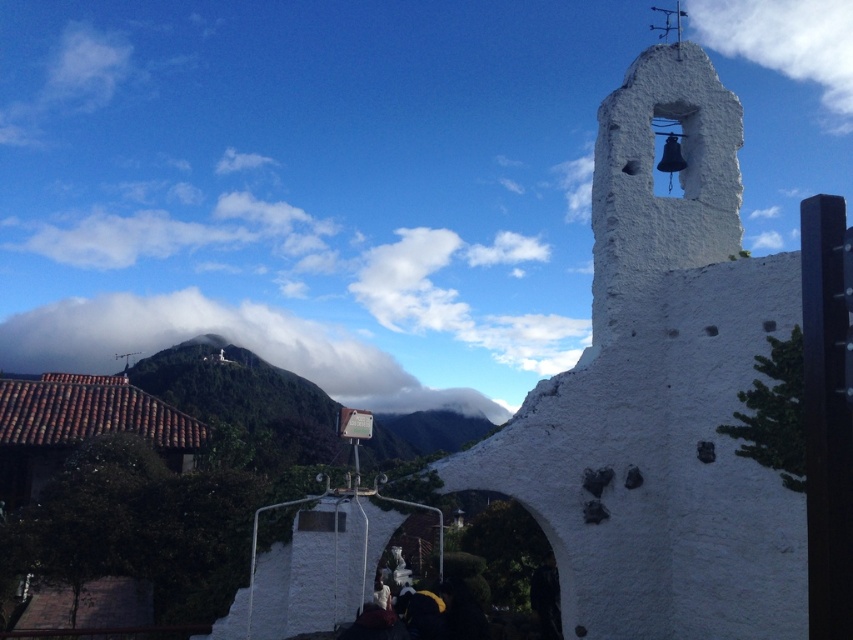
Does green grassy hill at lower left appear on the left side of white fluffy cloud at upper center?

Yes, green grassy hill at lower left is to the left of white fluffy cloud at upper center.

Who is more forward, (210, 384) or (816, 83)?

Point (210, 384) is in front.

Image resolution: width=853 pixels, height=640 pixels. I want to click on green grassy hill at lower left, so click(242, 394).

Does white fluffy cloud at upper left have a lesser width compared to white fluffy cloud at upper center?

Incorrect, white fluffy cloud at upper left's width is not less than white fluffy cloud at upper center's.

Between point (421, 397) and point (842, 19), which one is positioned behind?

The point (842, 19) is more distant.

Where is `white fluffy cloud at upper left`? This screenshot has height=640, width=853. white fluffy cloud at upper left is located at coordinates (225, 339).

Which is more to the right, white fluffy cloud at upper left or green grassy hill at lower left?

Positioned to the right is green grassy hill at lower left.

Can you confirm if white fluffy cloud at upper left is positioned above green grassy hill at lower left?

Indeed, white fluffy cloud at upper left is positioned over green grassy hill at lower left.

Is point (398, 397) closer to viewer compared to point (262, 369)?

No, (398, 397) is further to viewer.

The width and height of the screenshot is (853, 640). Find the location of `white fluffy cloud at upper left`. white fluffy cloud at upper left is located at coordinates (225, 339).